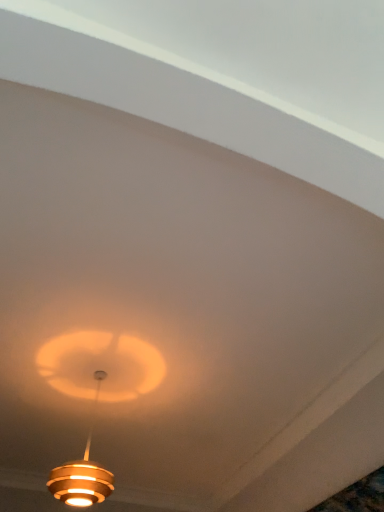
Question: Should I look upward or downward to see gold metallic lamp at center?

Choices:
 (A) up
 (B) down

Answer: (B)